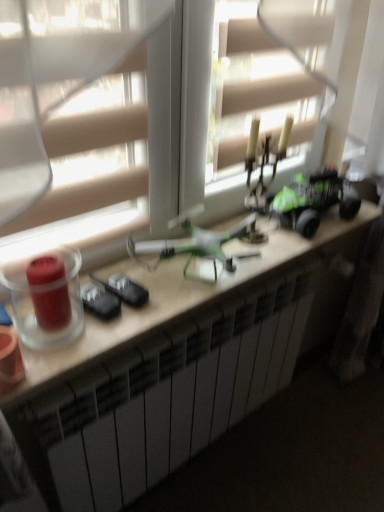
Question: From a real-world perspective, does transparent plastic window at center stand above white matte desk at center?

Choices:
 (A) yes
 (B) no

Answer: (A)

Question: From the image's perspective, is transparent plastic window at center beneath white matte desk at center?

Choices:
 (A) no
 (B) yes

Answer: (A)

Question: Considering the relative sizes of transparent plastic window at center and white matte desk at center in the image provided, is transparent plastic window at center wider than white matte desk at center?

Choices:
 (A) no
 (B) yes

Answer: (A)

Question: Does transparent plastic window at center appear on the right side of white matte desk at center?

Choices:
 (A) no
 (B) yes

Answer: (A)

Question: From the image's perspective, is transparent plastic window at center located above white matte desk at center?

Choices:
 (A) no
 (B) yes

Answer: (B)

Question: Is transparent plastic window at center not within white matte desk at center?

Choices:
 (A) no
 (B) yes

Answer: (B)

Question: Would you say transparent plastic window at center contains green matte toy car at right?

Choices:
 (A) no
 (B) yes

Answer: (A)

Question: Would you consider transparent plastic window at center to be distant from green matte toy car at right?

Choices:
 (A) no
 (B) yes

Answer: (A)

Question: Does transparent plastic window at center have a larger size compared to green matte toy car at right?

Choices:
 (A) no
 (B) yes

Answer: (B)

Question: Would you say transparent plastic window at center is outside green matte toy car at right?

Choices:
 (A) yes
 (B) no

Answer: (A)

Question: Is the surface of transparent plastic window at center in direct contact with green matte toy car at right?

Choices:
 (A) no
 (B) yes

Answer: (A)

Question: From a real-world perspective, does transparent plastic window at center sit lower than green matte toy car at right?

Choices:
 (A) yes
 (B) no

Answer: (B)

Question: Would you say transparent glass candle at left, the second candle holder positioned from the right, is outside white matte desk at center?

Choices:
 (A) no
 (B) yes

Answer: (B)